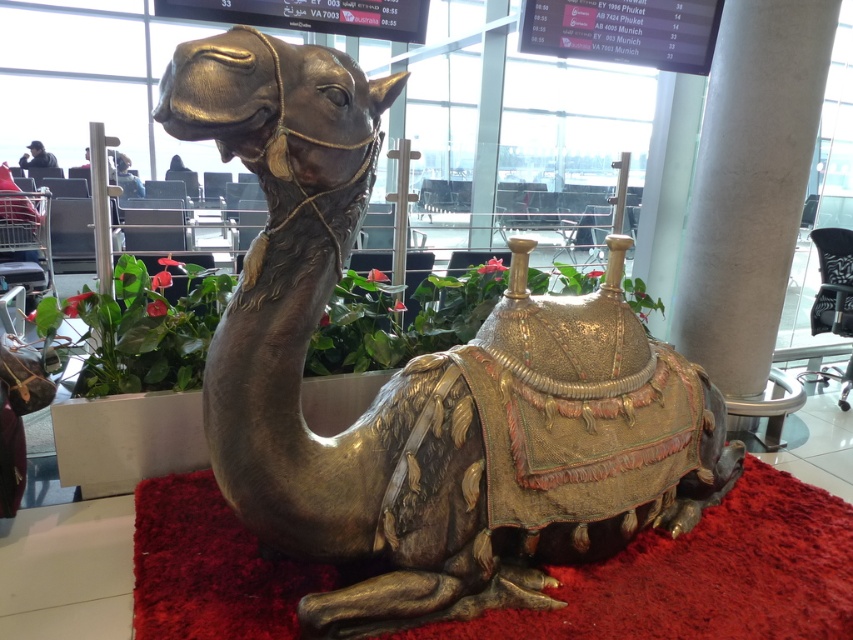
Question: Is gold metallic camel at center wider than shiny metallic mat at center?

Choices:
 (A) yes
 (B) no

Answer: (A)

Question: Can you confirm if gold metallic camel at center is positioned below shiny metallic mat at center?

Choices:
 (A) no
 (B) yes

Answer: (A)

Question: Among these objects, which one is nearest to the camera?

Choices:
 (A) gold metallic camel at center
 (B) shiny metallic mat at center

Answer: (A)

Question: Which point is closer to the camera taking this photo?

Choices:
 (A) (231, 428)
 (B) (189, 602)

Answer: (A)

Question: Does gold metallic camel at center come in front of shiny metallic mat at center?

Choices:
 (A) yes
 (B) no

Answer: (A)